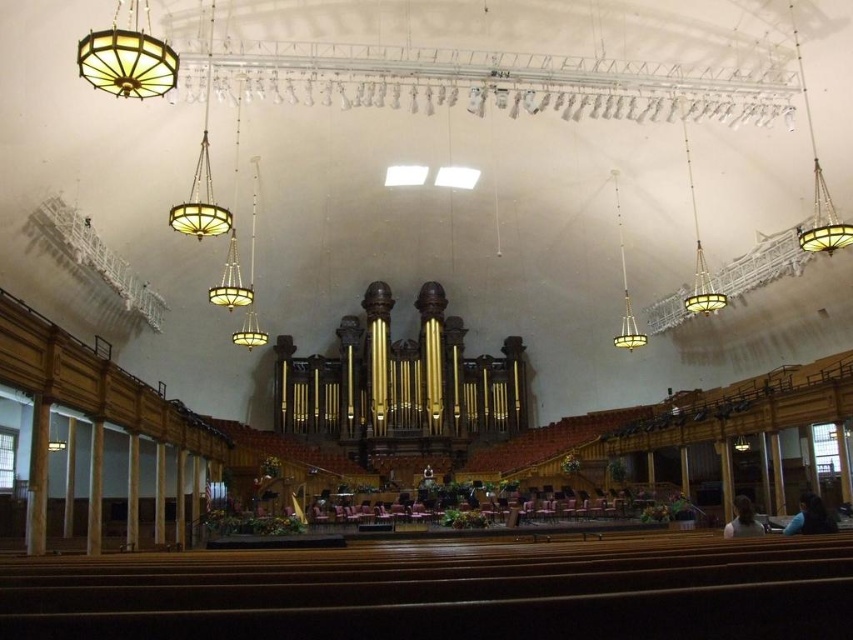
Does matte glass chandelier at upper center appear on the left side of matte gold chandelier at upper center?

No, matte glass chandelier at upper center is not to the left of matte gold chandelier at upper center.

Does matte glass chandelier at upper center lie in front of matte gold chandelier at upper center?

That is True.

Is point (689, 291) less distant than point (631, 317)?

Yes.

Where is `matte glass chandelier at upper center`? matte glass chandelier at upper center is located at coordinates (698, 250).